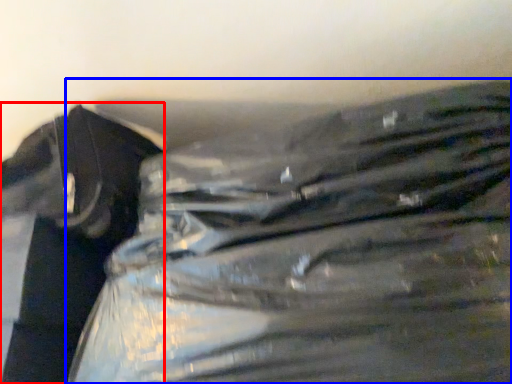
Question: Which object is further to the camera taking this photo, waste (highlighted by a red box) or plastic bag (highlighted by a blue box)?

Choices:
 (A) waste
 (B) plastic bag

Answer: (A)